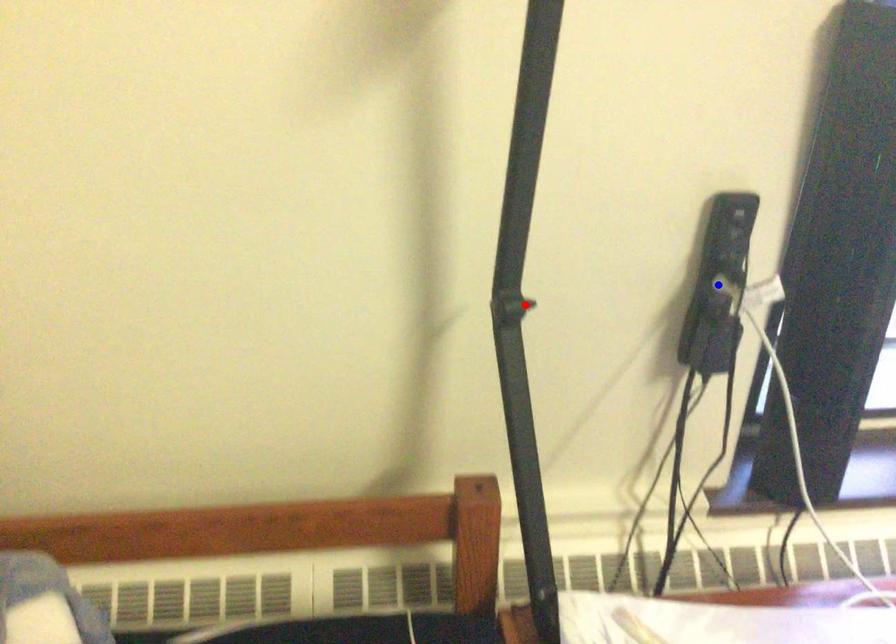
Question: In the image, two points are highlighted. Which point is nearer to the camera? Reply with the corresponding letter.

Choices:
 (A) blue point
 (B) red point

Answer: (B)